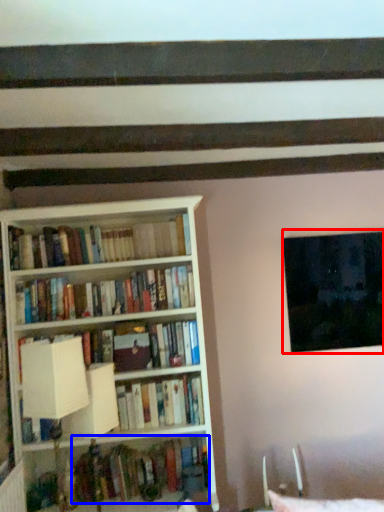
Question: Which of the following is the closest to the observer, window (highlighted by a red box) or book (highlighted by a blue box)?

Choices:
 (A) window
 (B) book

Answer: (B)